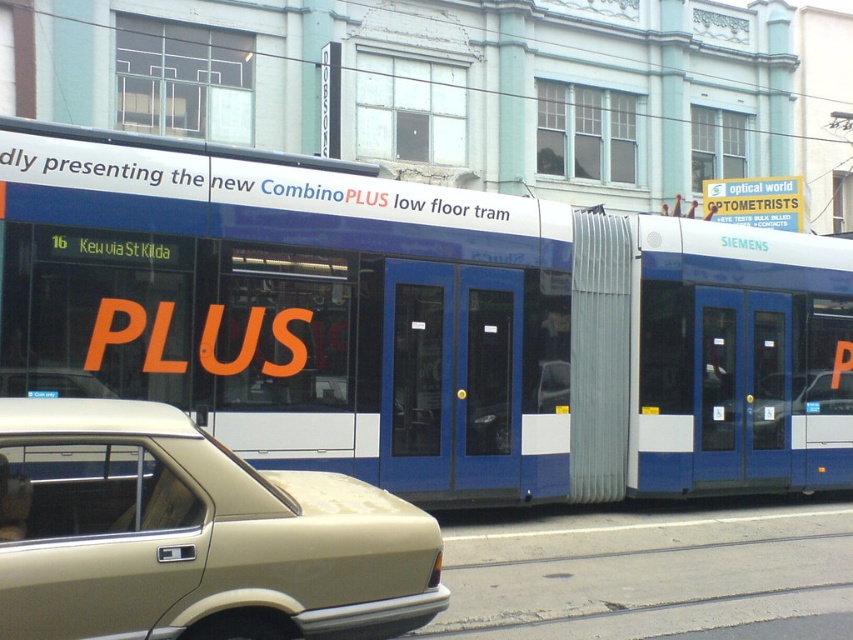
Between white matte bus at center and beige matte sedan at lower left, which one is positioned lower?

beige matte sedan at lower left

Does point (825, 275) lie behind point (167, 508)?

Yes, it is behind point (167, 508).

Which is behind, point (637, 282) or point (13, 620)?

The point (637, 282) is behind.

This screenshot has width=853, height=640. Identify the location of white matte bus at center. [x=422, y=323].